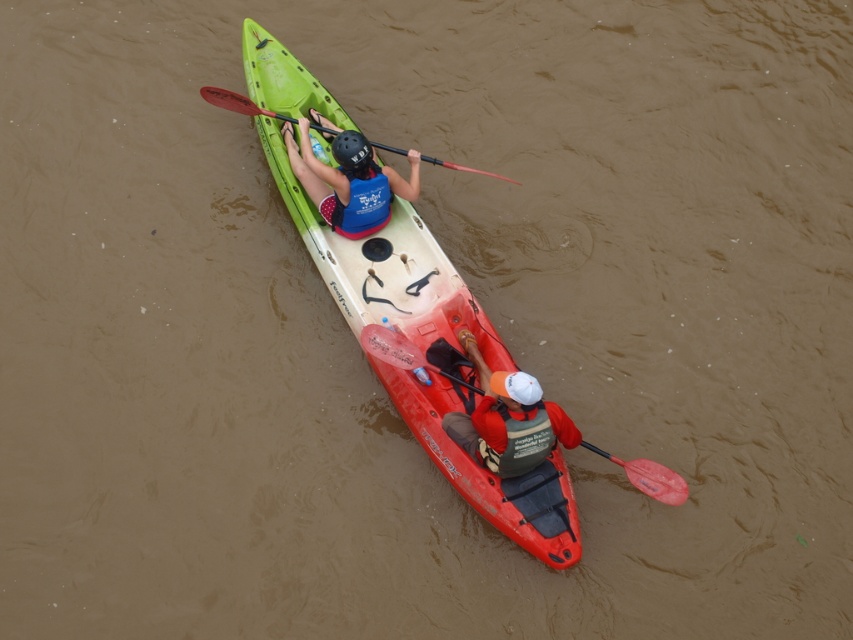
Measure the distance between green matte kayak at upper center and rubber paddle at lower right.

green matte kayak at upper center and rubber paddle at lower right are 37.18 inches apart from each other.

Between green matte kayak at upper center and rubber paddle at lower right, which one appears on the left side from the viewer's perspective?

green matte kayak at upper center

Who is more forward, (352, 244) or (369, 337)?

Positioned in front is point (369, 337).

Image resolution: width=853 pixels, height=640 pixels. I want to click on green matte kayak at upper center, so click(x=386, y=268).

Who is more distant from viewer, (364, 243) or (350, 225)?

Positioned behind is point (364, 243).

Between green matte kayak at upper center and matte blue life vest at center, which one has more height?

With more height is green matte kayak at upper center.

Between point (294, 76) and point (297, 168), which one is positioned behind?

Positioned behind is point (294, 76).

The height and width of the screenshot is (640, 853). I want to click on green matte kayak at upper center, so click(386, 268).

What do you see at coordinates (519, 435) in the screenshot?
I see `green fabric life jacket at center` at bounding box center [519, 435].

Is green fabric life jacket at center above red plastic paddle at upper center?

No, green fabric life jacket at center is not above red plastic paddle at upper center.

The height and width of the screenshot is (640, 853). Find the location of `green fabric life jacket at center`. green fabric life jacket at center is located at coordinates (519, 435).

This screenshot has width=853, height=640. I want to click on green fabric life jacket at center, so click(519, 435).